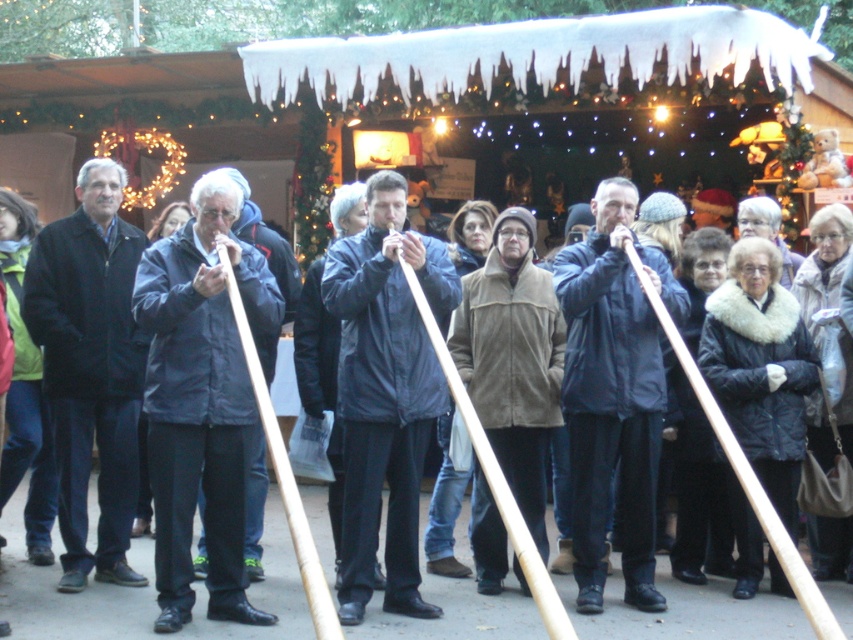
You are organizing a photo shoot and need to ensure that both the dark blue jacket at center and the brown suede jacket at center are visible in the frame. Given their sizes, which jacket should you position closer to the camera to maintain their visibility?

The dark blue jacket at center is bigger than the brown suede jacket at center, so to maintain visibility for both, position the smaller brown suede jacket at center closer to the camera. This way, even though it is smaller, its proximity will make it appear more prominent in the frame.

You are at the Christmas market and want to buy a souvenir. You see the dark blue jacket at center and the brown suede jacket at center. Which jacket is positioned more to the left?

The dark blue jacket at center is positioned more to the left than the brown suede jacket at center.

You are a photographer at the Christmas market and want to capture both the dark blue jacket at center and the brown suede jacket at center in a single photo. However, you notice that one of the jackets is much taller than the other. Which jacket should you position closer to the camera to ensure both are fully visible in the frame?

The dark blue jacket at center is much taller than the brown suede jacket at center. To ensure both are fully visible, position the brown suede jacket at center closer to the camera since it is shorter and needs to be magnified slightly to match the height of the taller dark blue jacket at center in the photo.